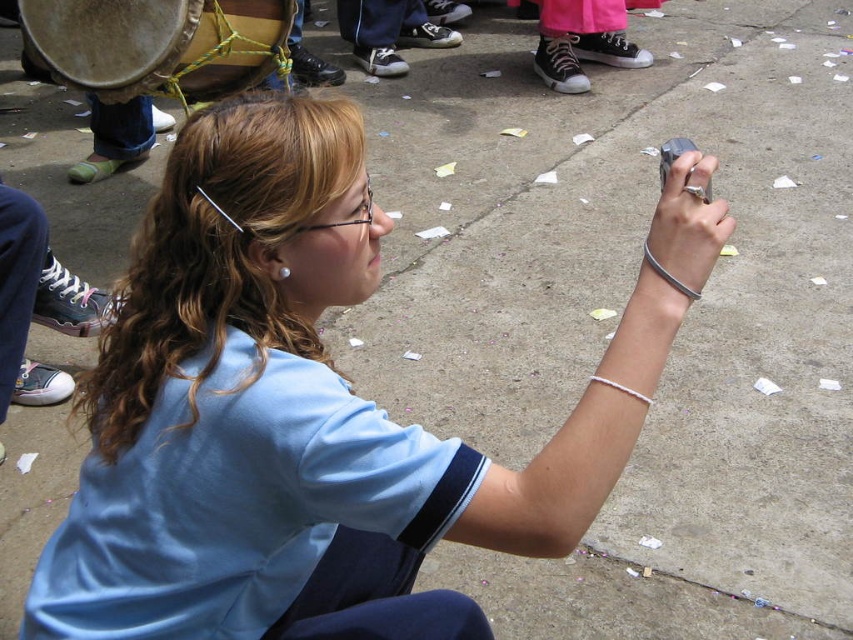
You are standing at the back of the crowd and want to take a photo of the pink canvas shoes at center without the wooden drum at left blocking the view. Is this possible?

The wooden drum at left is closer to the viewer than the pink canvas shoes at center, so the wooden drum at left would block the view of the pink canvas shoes at center. You would need to move closer or find a different angle to avoid the obstruction.

You are organizing a small event and need to place a decorative item between the wooden drum at left and the pink canvas shoes at center. Considering their sizes, which object should you place closer to the center of the area to ensure there is enough space?

The wooden drum at left is wider than the pink canvas shoes at center, so placing the decorative item closer to the pink canvas shoes at center would leave more space for the larger wooden drum at left.

You are a photographer standing at the edge of the event. You need to capture a clear shot of the wooden drum at left without the pink canvas shoes at center blocking it. Is this possible given their positions?

The wooden drum at left is positioned under the pink canvas shoes at center, so it is partially or fully hidden by the shoes. Therefore, capturing a clear shot of the wooden drum at left without obstruction might not be possible unless you adjust your angle or move closer.